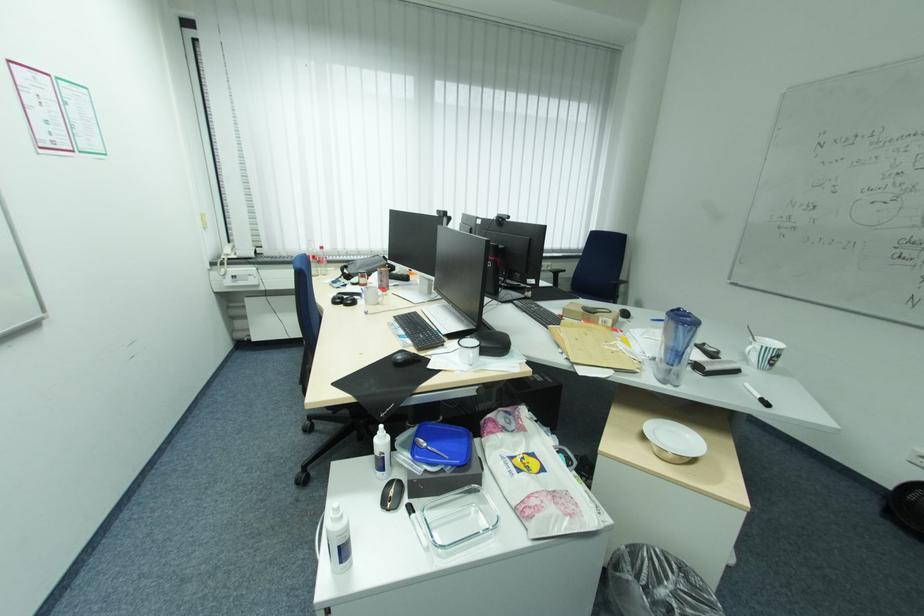
The width and height of the screenshot is (924, 616). I want to click on striped mug handle, so click(x=749, y=354).